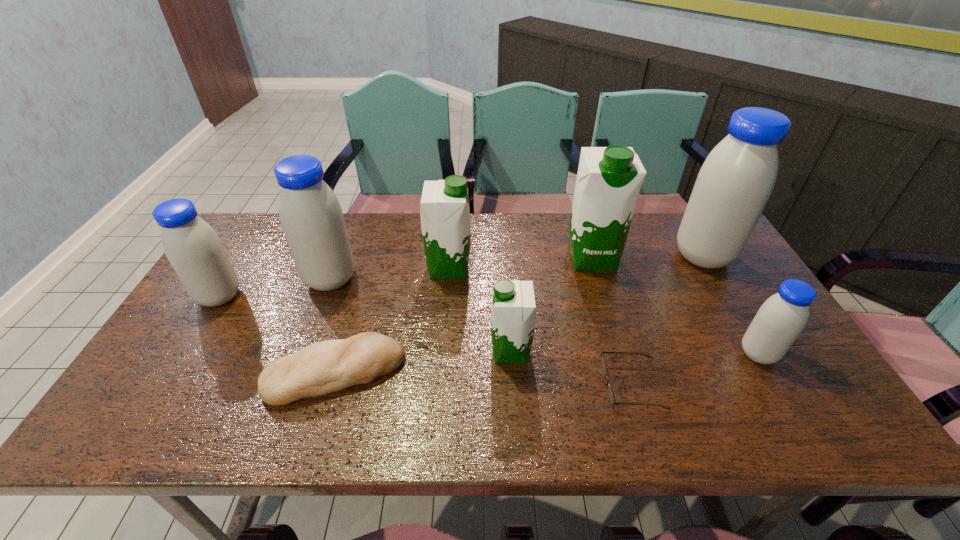
Image resolution: width=960 pixels, height=540 pixels. In order to click on vacant point located between the biggest blue soya milk and the spectacles in this screenshot , I will do `click(668, 320)`.

The height and width of the screenshot is (540, 960). In order to click on vacant area that lies between the third soya milk from right to left and the fifth soya milk from right to left in this screenshot , I will do `click(520, 262)`.

Identify the location of vacant region between the rightmost green soya milk and the sixth object from right to left. The image size is (960, 540). (520, 262).

Locate an element on the screen. The height and width of the screenshot is (540, 960). vacant area between the nearest green soya milk and the third soya milk from right to left is located at coordinates coord(551,304).

Find the location of a particular element. free space between the nearest green soya milk and the leftmost soya milk is located at coordinates (365, 324).

This screenshot has width=960, height=540. What are the coordinates of `vacant area that lies between the third soya milk from right to left and the fifth soya milk from right to left` in the screenshot? It's located at (520, 262).

Locate an element on the screen. free spot between the shortest object and the fifth soya milk from left to right is located at coordinates (612, 320).

Identify which object is the eighth nearest to the shortest object. Please provide its 2D coordinates. Your answer should be formatted as a tuple, i.e. [(x, y)], where the tuple contains the x and y coordinates of a point satisfying the conditions above.

[(193, 248)]

Identify which object is the fifth closest to the rightmost green soya milk. Please provide its 2D coordinates. Your answer should be formatted as a tuple, i.e. [(x, y)], where the tuple contains the x and y coordinates of a point satisfying the conditions above.

[(782, 317)]

Where is `soya milk that stands as the closest to the tallest soya milk`? soya milk that stands as the closest to the tallest soya milk is located at coordinates (609, 179).